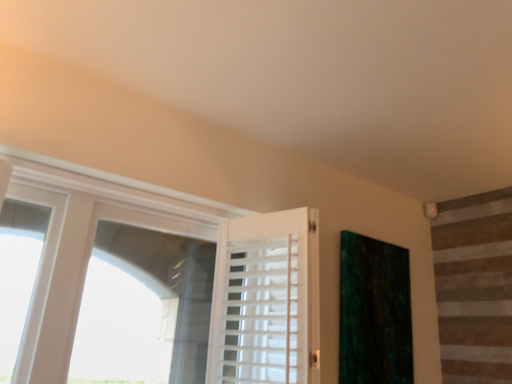
Question: Is green velvet curtain at right spatially inside white wood barn door at center, or outside of it?

Choices:
 (A) outside
 (B) inside

Answer: (A)

Question: In terms of size, does green velvet curtain at right appear bigger or smaller than white wood barn door at center?

Choices:
 (A) small
 (B) big

Answer: (A)

Question: Looking at their shapes, would you say green velvet curtain at right is wider or thinner than white wood barn door at center?

Choices:
 (A) thin
 (B) wide

Answer: (A)

Question: Based on their sizes in the image, would you say white wood barn door at center is bigger or smaller than green velvet curtain at right?

Choices:
 (A) small
 (B) big

Answer: (B)

Question: From the image's perspective, is white wood barn door at center located above or below green velvet curtain at right?

Choices:
 (A) below
 (B) above

Answer: (B)

Question: Considering their positions, is white wood barn door at center located in front of or behind green velvet curtain at right?

Choices:
 (A) behind
 (B) front

Answer: (B)

Question: Based on their positions, is white wood barn door at center located to the left or right of green velvet curtain at right?

Choices:
 (A) right
 (B) left

Answer: (B)